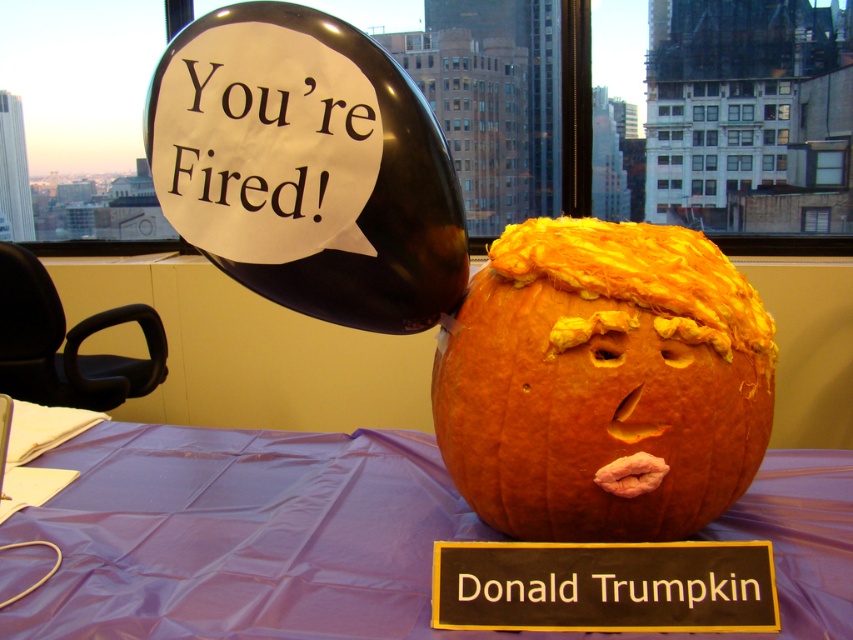
Based on the photo, you are a child trying to reach both the orange carved pumpkin at center and the white paper at upper center on the table. If your hand can only reach 8 inches, which item can you grab?

The distance between the orange carved pumpkin at center and the white paper at upper center is 9.30 inches. Since your hand can only reach 8 inches, you cannot reach both items simultaneously. You can only grab whichever is closer to your current position.